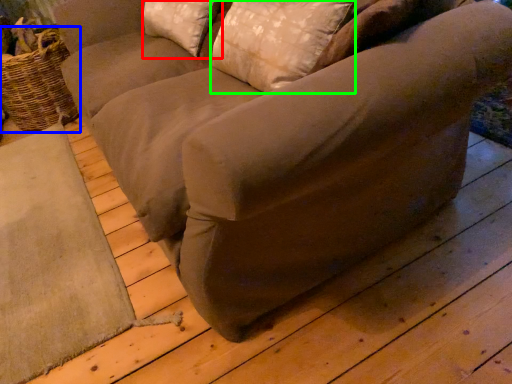
Question: Which object is positioned farthest from pillow (highlighted by a red box)? Select from basket (highlighted by a blue box) and pillow (highlighted by a green box).

Choices:
 (A) basket
 (B) pillow

Answer: (A)